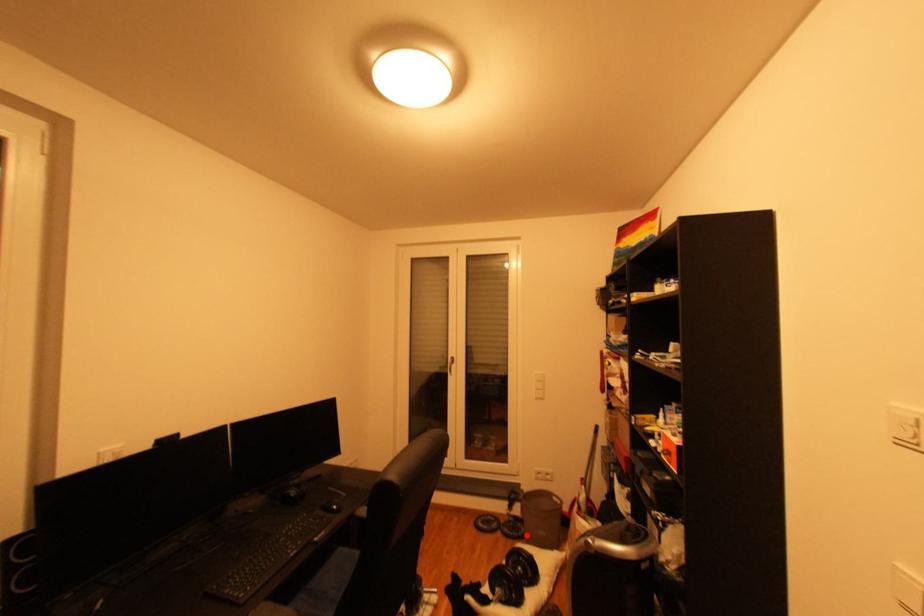
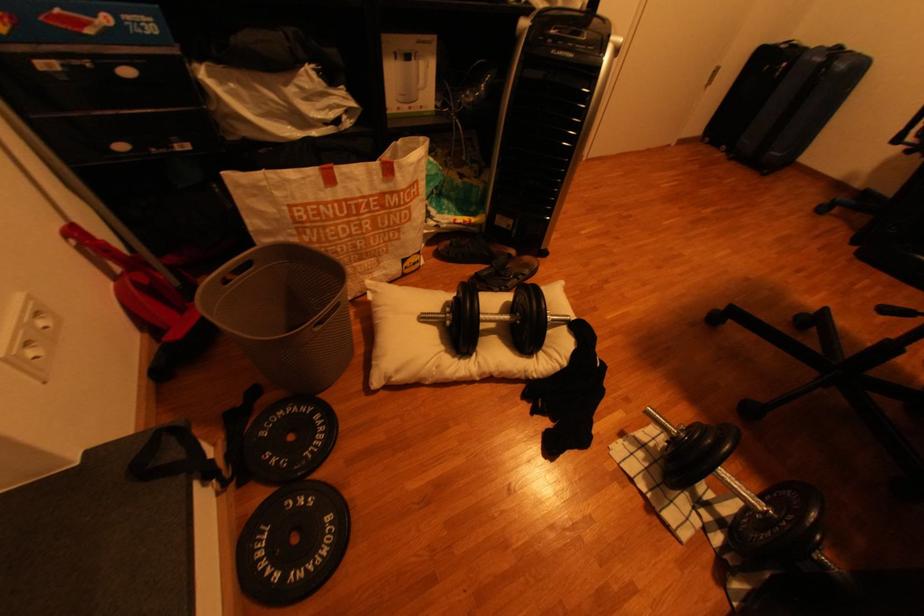
Locate, in the second image, the point that corresponds to the highlighted location in the first image.

(325, 419)